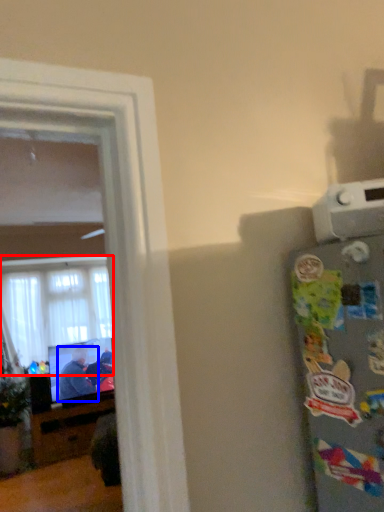
Question: Which object appears closest to the camera in this image, window (highlighted by a red box) or person (highlighted by a blue box)?

Choices:
 (A) window
 (B) person

Answer: (B)